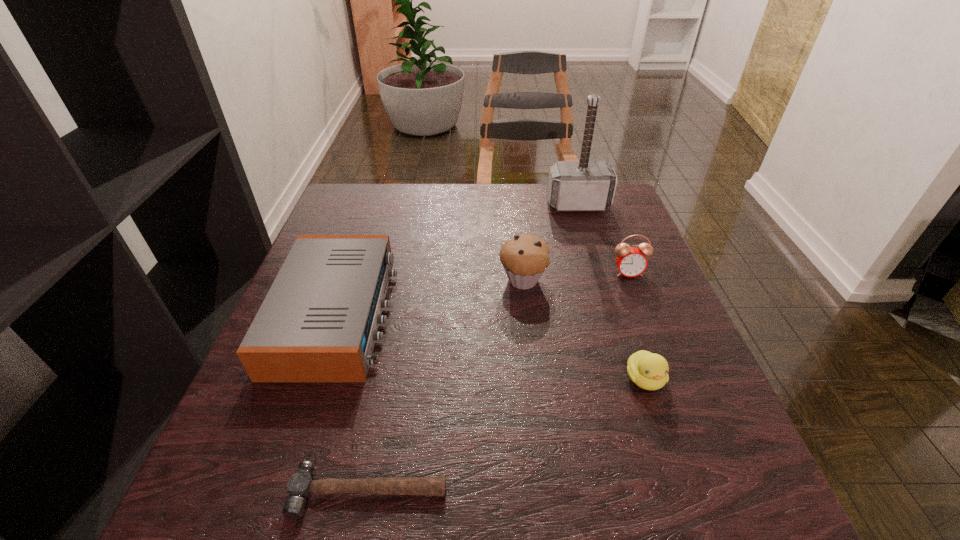
Identify the location of free space located on the clock face of the alarm clock. (683, 412).

Locate an element on the screen. free region located 0.080m on the front panel of the radio receiver is located at coordinates (427, 315).

Image resolution: width=960 pixels, height=540 pixels. In order to click on free location located at the beak of the duckling in this screenshot , I will do pyautogui.click(x=674, y=465).

Locate an element on the screen. This screenshot has width=960, height=540. object present at the far edge is located at coordinates (586, 185).

I want to click on object located at the near edge, so click(x=300, y=486).

Locate an element on the screen. Image resolution: width=960 pixels, height=540 pixels. radio receiver that is at the left edge is located at coordinates (319, 321).

This screenshot has height=540, width=960. Find the location of `hammer that is at the left edge`. hammer that is at the left edge is located at coordinates (300, 486).

The image size is (960, 540). I want to click on hammer at the right edge, so click(x=586, y=185).

Locate an element on the screen. alarm clock at the right edge is located at coordinates (631, 261).

The image size is (960, 540). In order to click on duckling situated at the right edge in this screenshot , I will do `click(649, 371)`.